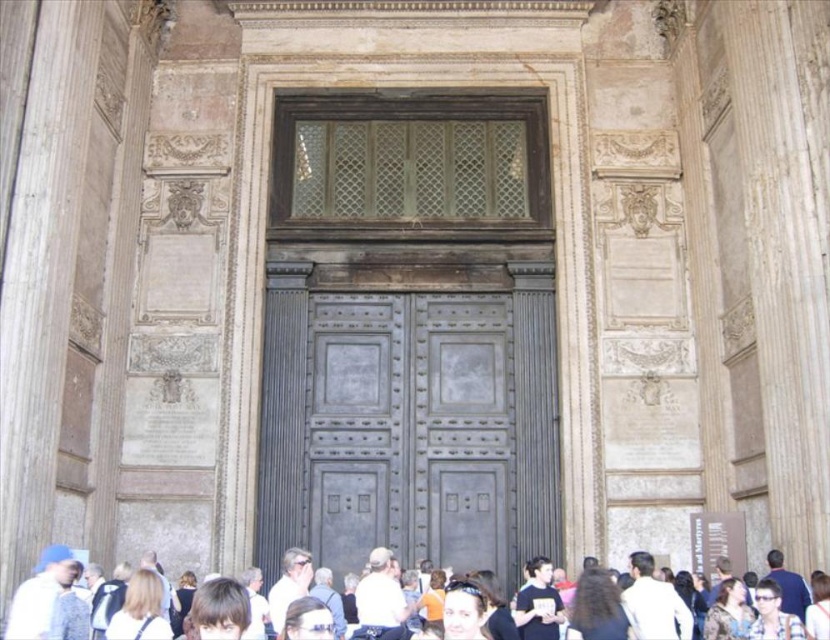
Question: Is dark blue shirt at center to the left of camouflage-patterned jacket at lower right from the viewer's perspective?

Choices:
 (A) yes
 (B) no

Answer: (A)

Question: Can you confirm if dark gray metal door at center is wider than dark brown hair at center?

Choices:
 (A) yes
 (B) no

Answer: (A)

Question: Considering the real-world distances, which object is farthest from the white casual clothing at lower center?

Choices:
 (A) dark blue shirt at center
 (B) camouflage-patterned jacket at lower right
 (C) dark brown hair at center
 (D) brown hair at center

Answer: (D)

Question: Which of the following is the farthest from the observer?

Choices:
 (A) brown hair at center
 (B) matte black sunglasses at center
 (C) white fabric at center

Answer: (B)

Question: Which object appears closest to the camera in this image?

Choices:
 (A) camouflage-patterned jacket at lower right
 (B) white cotton shirt at center
 (C) brown hair at center
 (D) matte black sunglasses at center

Answer: (C)

Question: Can you confirm if brown hair at center is positioned below matte black sunglasses at center?

Choices:
 (A) yes
 (B) no

Answer: (A)